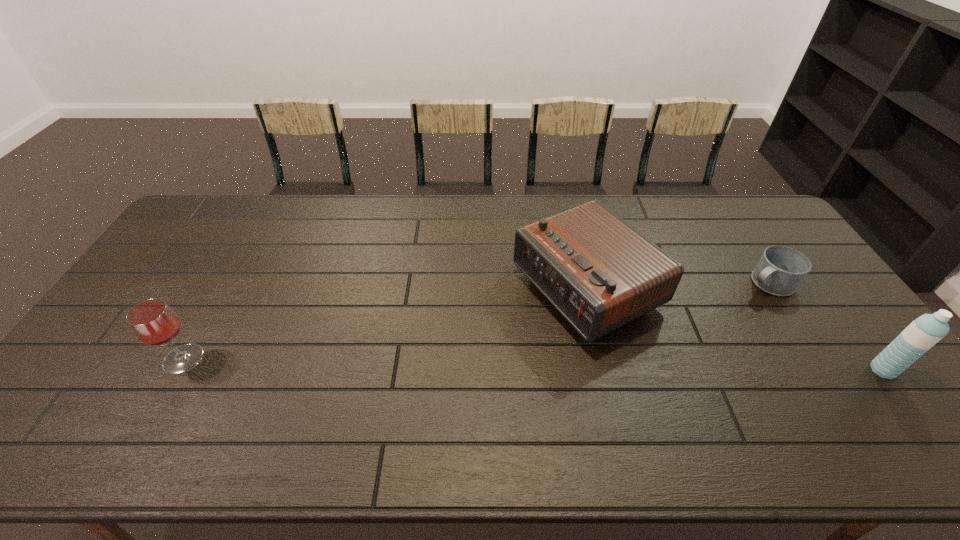
Where is `free space between the mug and the rightmost object`? free space between the mug and the rightmost object is located at coordinates (825, 326).

You are a GUI agent. You are given a task and a screenshot of the screen. Output one action in this format:
    pyautogui.click(x=<x>, y=<y>)
    Task: Click on the vacant space that's between the water bottle and the third object from right to left
    The image size is (960, 540).
    Given the screenshot: What is the action you would take?
    pyautogui.click(x=734, y=330)

Where is `free space between the leftmost object and the mug`? Image resolution: width=960 pixels, height=540 pixels. free space between the leftmost object and the mug is located at coordinates (475, 321).

Identify the location of vacant space that is in between the third object from left to right and the wineglass. The width and height of the screenshot is (960, 540). (475, 321).

This screenshot has width=960, height=540. What are the coordinates of `free space that is in between the water bottle and the wineglass` in the screenshot? It's located at (533, 364).

Find the location of a particular element. The width and height of the screenshot is (960, 540). vacant point located between the second object from left to right and the wineglass is located at coordinates (385, 325).

This screenshot has width=960, height=540. I want to click on the closest object to the third object from right to left, so click(x=781, y=269).

Select which object appears as the closest to the wineglass. Please provide its 2D coordinates. Your answer should be formatted as a tuple, i.e. [(x, y)], where the tuple contains the x and y coordinates of a point satisfying the conditions above.

[(600, 273)]

Find the location of `vacant position in the image that satisfies the following two spatial constraints: 1. on the back side of the wineglass; 2. on the right side of the mug`. vacant position in the image that satisfies the following two spatial constraints: 1. on the back side of the wineglass; 2. on the right side of the mug is located at coordinates (228, 282).

Find the location of a particular element. This screenshot has height=540, width=960. vacant point that satisfies the following two spatial constraints: 1. on the back side of the radio receiver; 2. on the right side of the mug is located at coordinates (585, 282).